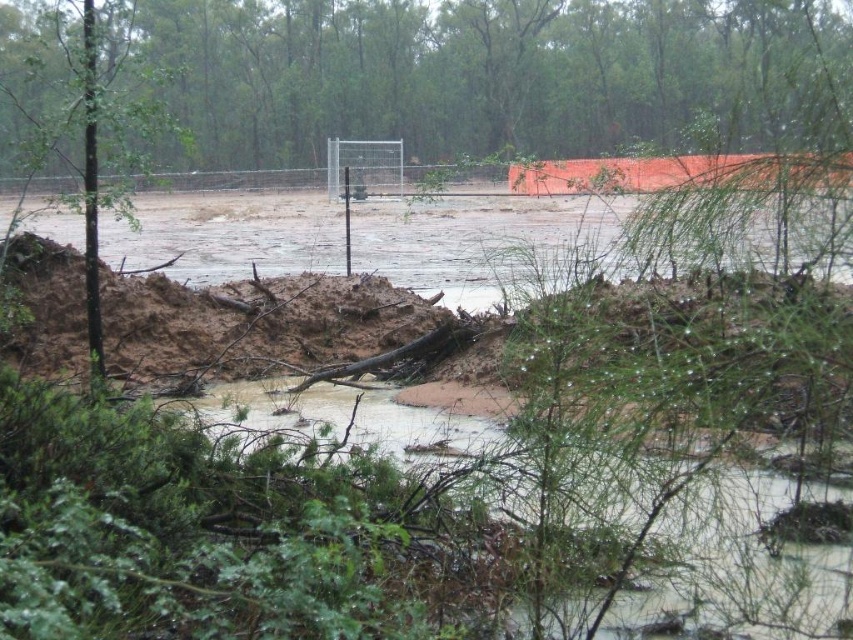
Question: Which point is farther to the camera?

Choices:
 (A) (767, 477)
 (B) (782, 128)

Answer: (B)

Question: Does green matte fence at upper center appear under brown muddy water at center?

Choices:
 (A) yes
 (B) no

Answer: (B)

Question: Does green matte fence at upper center have a larger size compared to brown muddy water at center?

Choices:
 (A) no
 (B) yes

Answer: (B)

Question: Which of the following is the farthest from the observer?

Choices:
 (A) brown muddy water at center
 (B) green matte fence at upper center

Answer: (B)

Question: Can you confirm if green matte fence at upper center is positioned above brown muddy water at center?

Choices:
 (A) no
 (B) yes

Answer: (B)